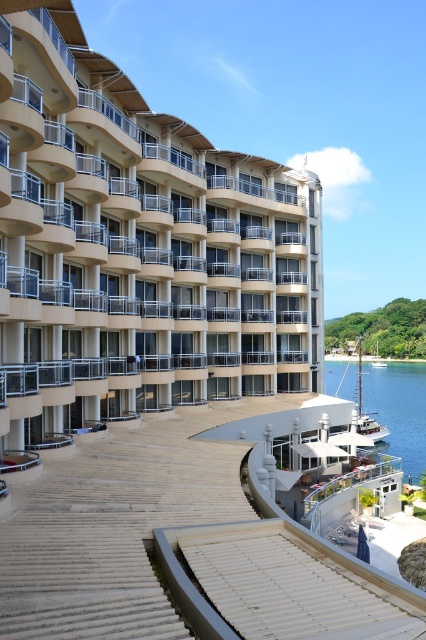
Is clear blue water at lower right bigger than white wooden sailboat at lower right?

Actually, clear blue water at lower right might be smaller than white wooden sailboat at lower right.

Is point (373, 397) positioned before point (357, 417)?

No.

What are the coordinates of `clear blue water at lower right` in the screenshot? It's located at coord(399,410).

Between beige concrete building at center and white wooden sailboat at lower right, which one has more height?

beige concrete building at center

Is beige concrete building at center thinner than white wooden sailboat at lower right?

Yes, beige concrete building at center is thinner than white wooden sailboat at lower right.

Image resolution: width=426 pixels, height=640 pixels. I want to click on beige concrete building at center, so click(x=138, y=248).

Where is `beige concrete building at center`? beige concrete building at center is located at coordinates (138, 248).

Image resolution: width=426 pixels, height=640 pixels. Describe the element at coordinates (138, 248) in the screenshot. I see `beige concrete building at center` at that location.

Does point (100, 116) come farther from viewer compared to point (414, 420)?

No, it is not.

The width and height of the screenshot is (426, 640). What do you see at coordinates (138, 248) in the screenshot? I see `beige concrete building at center` at bounding box center [138, 248].

Locate an element on the screen. The height and width of the screenshot is (640, 426). beige concrete building at center is located at coordinates (138, 248).